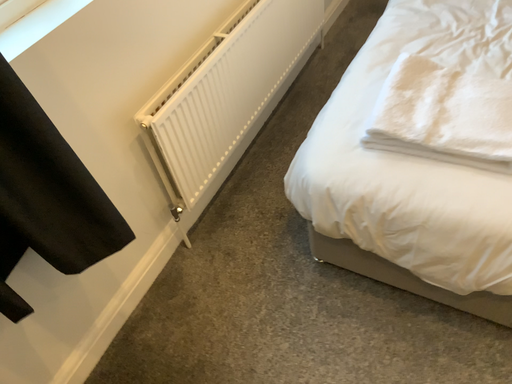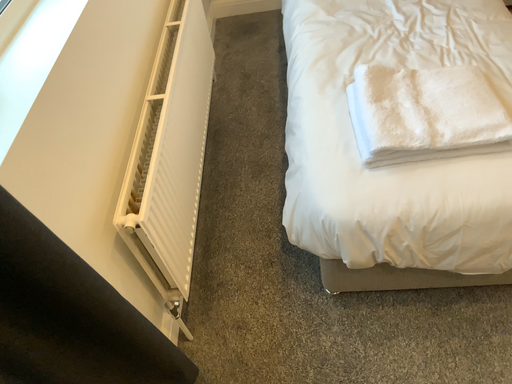
Question: Which way did the camera rotate in the video?

Choices:
 (A) rotated left
 (B) rotated right

Answer: (B)